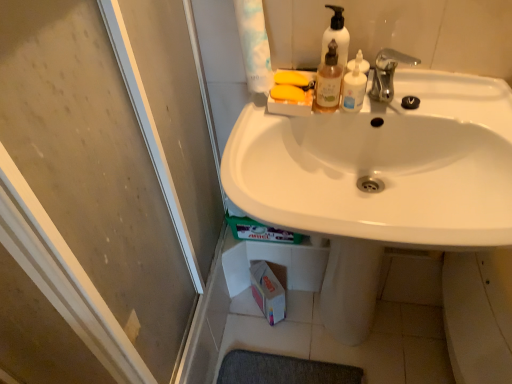
Question: Can you confirm if translucent plastic pump bottle at upper center is positioned to the right of white glossy sink at center?

Choices:
 (A) yes
 (B) no

Answer: (B)

Question: Could you tell me if translucent plastic pump bottle at upper center is facing white glossy sink at center?

Choices:
 (A) yes
 (B) no

Answer: (B)

Question: Are translucent plastic pump bottle at upper center and white glossy sink at center far apart?

Choices:
 (A) yes
 (B) no

Answer: (B)

Question: Can you confirm if translucent plastic pump bottle at upper center is smaller than white glossy sink at center?

Choices:
 (A) yes
 (B) no

Answer: (A)

Question: Is translucent plastic pump bottle at upper center in contact with white glossy sink at center?

Choices:
 (A) no
 (B) yes

Answer: (A)

Question: From a real-world perspective, is white plastic mouthwash at upper center, which is the 2th mouthwash from left to right, positioned above or below white glossy sink at center?

Choices:
 (A) above
 (B) below

Answer: (A)

Question: In terms of height, does white plastic mouthwash at upper center, positioned as the first mouthwash in right-to-left order, look taller or shorter compared to white glossy sink at center?

Choices:
 (A) tall
 (B) short

Answer: (B)

Question: Would you say white plastic mouthwash at upper center, positioned as the first mouthwash in right-to-left order, is to the left or to the right of white glossy sink at center in the picture?

Choices:
 (A) right
 (B) left

Answer: (B)

Question: Is white plastic mouthwash at upper center, which is the 2th mouthwash from left to right, in front of or behind white glossy sink at center in the image?

Choices:
 (A) behind
 (B) front

Answer: (A)

Question: Based on their positions, is silver metallic faucet at upper center located to the left or right of transparent glass screen door at left?

Choices:
 (A) left
 (B) right

Answer: (B)

Question: From a real-world perspective, is silver metallic faucet at upper center above or below transparent glass screen door at left?

Choices:
 (A) below
 (B) above

Answer: (B)

Question: Considering the positions of silver metallic faucet at upper center and transparent glass screen door at left in the image, is silver metallic faucet at upper center bigger or smaller than transparent glass screen door at left?

Choices:
 (A) small
 (B) big

Answer: (A)

Question: Do you think silver metallic faucet at upper center is within transparent glass screen door at left, or outside of it?

Choices:
 (A) inside
 (B) outside

Answer: (B)

Question: In terms of height, does translucent plastic pump bottle at upper center look taller or shorter compared to translucent plastic bottle at upper center, which appears as the second mouthwash when viewed from the right?

Choices:
 (A) short
 (B) tall

Answer: (B)

Question: Is translucent plastic pump bottle at upper center bigger or smaller than translucent plastic bottle at upper center, which appears as the second mouthwash when viewed from the right?

Choices:
 (A) big
 (B) small

Answer: (A)